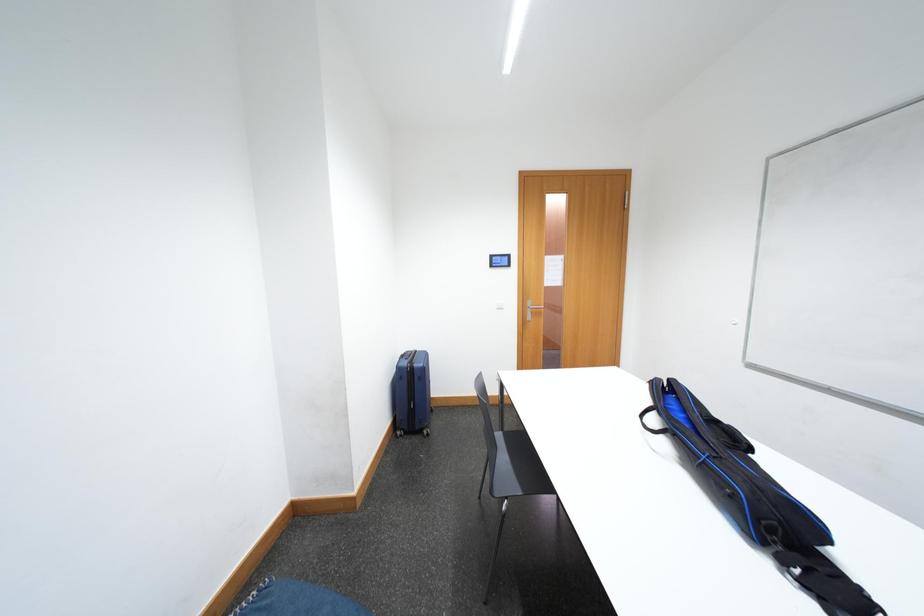
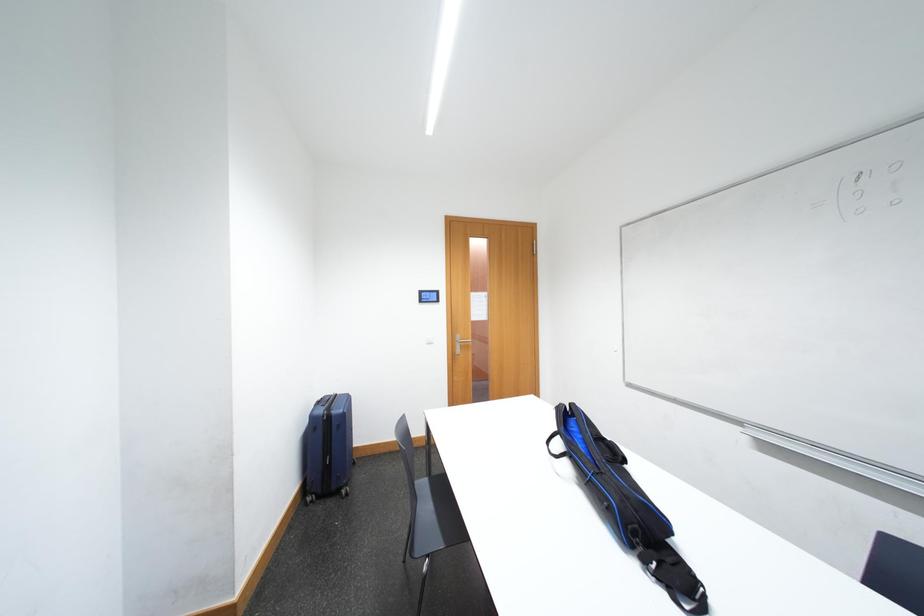
Question: The camera is either moving clockwise (left) or counter-clockwise (right) around the object. The first image is from the beginning of the video and the second image is from the end. Is the camera moving left or right when shooting the video?

Choices:
 (A) Left
 (B) Right

Answer: (A)